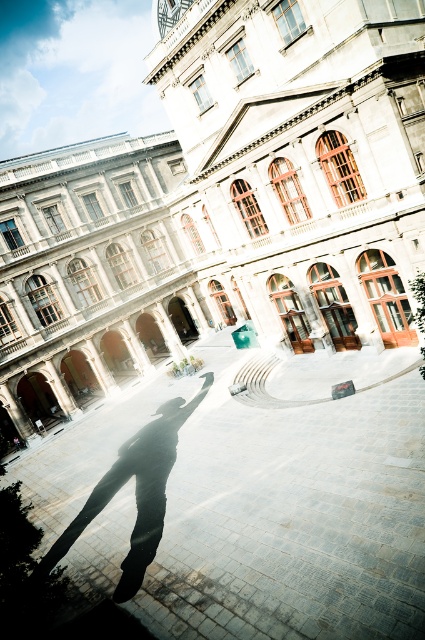
Which is more to the left, white stone building at center or smooth stone pavement at center?

Positioned to the left is white stone building at center.

What are the coordinates of `white stone building at center` in the screenshot? It's located at (223, 202).

Is point (187, 29) positioned behind point (68, 564)?

That is True.

The image size is (425, 640). I want to click on white stone building at center, so click(223, 202).

Does smooth stone pavement at center have a smaller size compared to black matte skateboard at center?

Actually, smooth stone pavement at center might be larger than black matte skateboard at center.

Who is more forward, (215, 362) or (118, 600)?

Positioned in front is point (118, 600).

Image resolution: width=425 pixels, height=640 pixels. In order to click on smooth stone pavement at center in this screenshot , I will do `click(246, 500)`.

Is the position of white stone building at center more distant than that of black matte skateboard at center?

Yes, it is behind black matte skateboard at center.

Which is below, white stone building at center or black matte skateboard at center?

black matte skateboard at center is lower down.

What are the coordinates of `white stone building at center` in the screenshot? It's located at (223, 202).